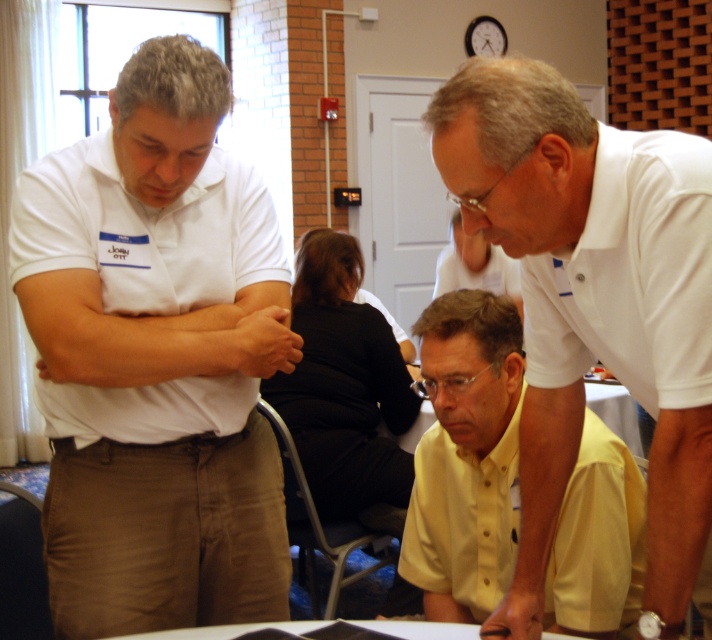
Question: Can you confirm if white cotton shirt at left is wider than white matte shirt at left?

Choices:
 (A) no
 (B) yes

Answer: (B)

Question: Which object is positioned closest to the yellow button-down shirt at center?

Choices:
 (A) matte white shirt at center
 (B) white smooth shirt at right

Answer: (B)

Question: Which point appears farthest from the camera in this image?

Choices:
 (A) (540, 538)
 (B) (402, 630)

Answer: (B)

Question: Can you confirm if white matte shirt at upper right is positioned above yellow button-down shirt at center?

Choices:
 (A) no
 (B) yes

Answer: (B)

Question: Can you confirm if white smooth shirt at right is bigger than white glossy table at lower center?

Choices:
 (A) yes
 (B) no

Answer: (B)

Question: Estimate the real-world distances between objects in this image. Which object is closer to the yellow button-down shirt at center?

Choices:
 (A) matte white shirt at center
 (B) white smooth shirt at right
 (C) black fabric shirt at center
 (D) white matte shirt at upper right

Answer: (D)